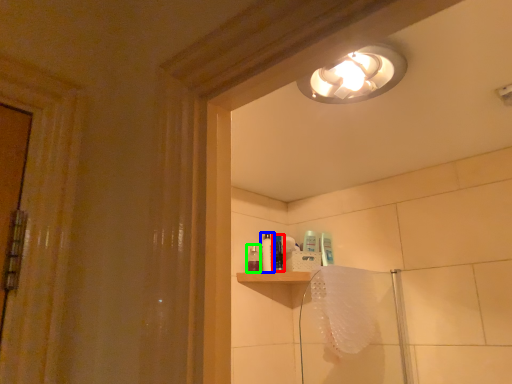
Question: Which is farther away from toiletry (highlighted by a red box)? toiletry (highlighted by a blue box) or toiletry (highlighted by a green box)?

Choices:
 (A) toiletry
 (B) toiletry

Answer: (B)